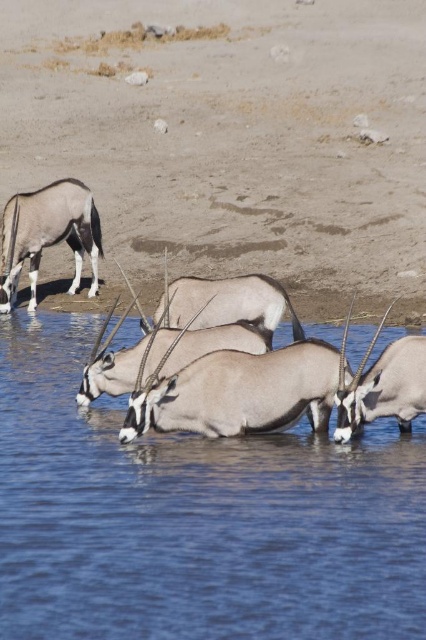
Which is more to the right, blue clear water at center or shiny brown antelope at upper left?

From the viewer's perspective, blue clear water at center appears more on the right side.

Is point (138, 468) less distant than point (11, 209)?

Yes, point (138, 468) is in front of point (11, 209).

Which is behind, point (414, 532) or point (31, 198)?

Positioned behind is point (31, 198).

This screenshot has width=426, height=640. In order to click on blue clear water at center in this screenshot , I will do `click(193, 516)`.

This screenshot has height=640, width=426. Identify the location of smooth brown antelope at center. (218, 317).

Find the location of a particular element. smooth brown antelope at center is located at coordinates (218, 317).

Does brown glossy antelope at lower center have a larger size compared to brown glossy antelope at center?

Yes.

Can you confirm if brown glossy antelope at lower center is wider than brown glossy antelope at center?

Indeed, brown glossy antelope at lower center has a greater width compared to brown glossy antelope at center.

Who is more distant from viewer, [91,243] or [365,390]?

Point [91,243]

You are a GUI agent. You are given a task and a screenshot of the screen. Output one action in this format:
    pyautogui.click(x=<x>, y=<y>)
    Task: Click on the brown glossy antelope at lower center
    The width and height of the screenshot is (426, 640).
    Given the screenshot: What is the action you would take?
    pyautogui.click(x=48, y=236)